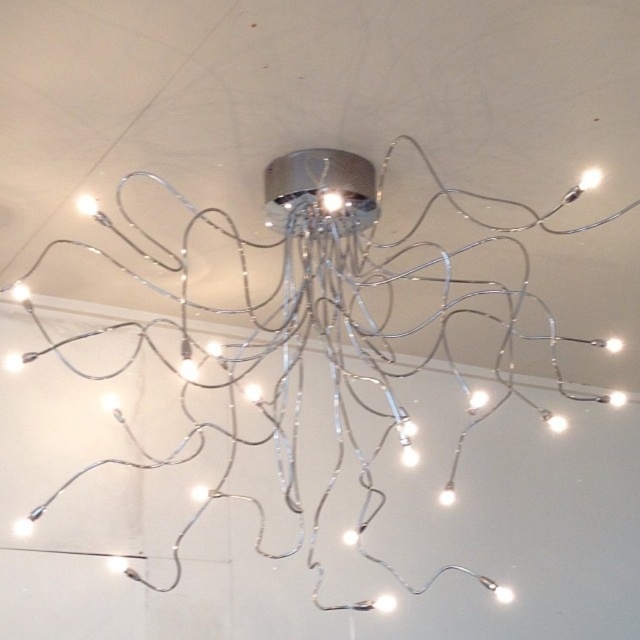
What is located at the coordinates point (332, 202) in the image?

The metallic wire at center is located at point (332, 202).

You are an interior designer assessing the space under the metallic wire chandelier at center and the metallic wire at center. Which object would require more horizontal space for placement?

The metallic wire chandelier at center would require more horizontal space for placement since it is wider than the metallic wire at center according to the description.

You are an interior designer assessing the height of the metallic wire at center and the white glossy light bulb at center in the octopus ceiling fixture. Which one has a greater height?

The white glossy light bulb at center is taller than the metallic wire at center.